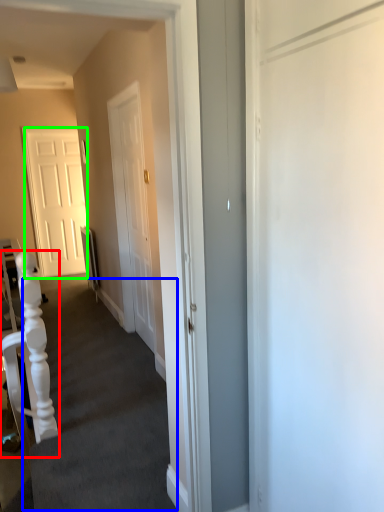
Question: Which object is the closest to the armchair (highlighted by a red box)? Choose among these: stairwell (highlighted by a blue box) or door (highlighted by a green box).

Choices:
 (A) stairwell
 (B) door

Answer: (A)